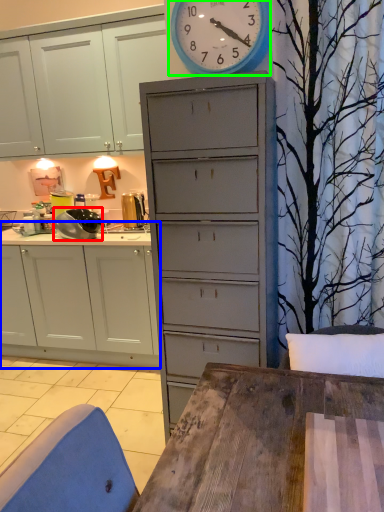
Question: Which is nearer to the appliance (highlighted by a red box)? cabinetry (highlighted by a blue box) or wall clock (highlighted by a green box).

Choices:
 (A) cabinetry
 (B) wall clock

Answer: (A)